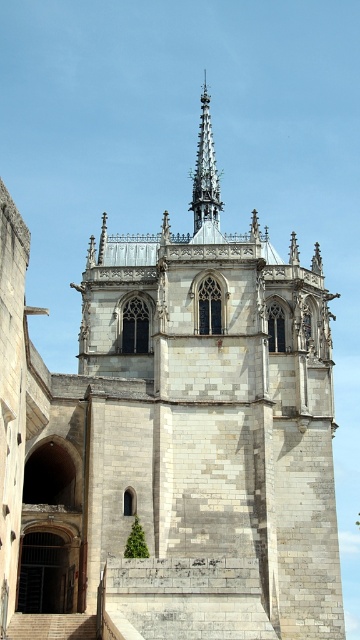
Question: Which point is closer to the camera taking this photo?

Choices:
 (A) (78, 632)
 (B) (213, 141)

Answer: (A)

Question: Can you confirm if gray stone spire at upper center is positioned above smooth stone stairs at lower left?

Choices:
 (A) yes
 (B) no

Answer: (A)

Question: Does gray stone spire at upper center have a larger size compared to smooth stone stairs at lower left?

Choices:
 (A) no
 (B) yes

Answer: (B)

Question: Which point is closer to the camera?

Choices:
 (A) gray stone spire at upper center
 (B) smooth stone stairs at lower left

Answer: (B)

Question: Does gray stone spire at upper center have a greater width compared to smooth stone stairs at lower left?

Choices:
 (A) no
 (B) yes

Answer: (A)